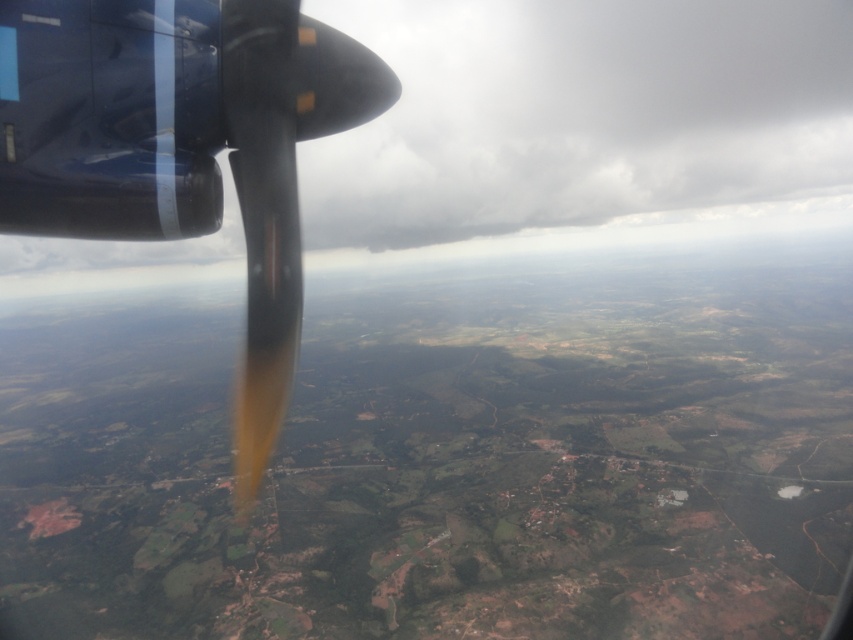
Which of these two, matte black propeller at upper left or shiny metallic propeller at upper left, stands taller?

With more height is matte black propeller at upper left.

Does matte black propeller at upper left have a larger size compared to shiny metallic propeller at upper left?

Correct, matte black propeller at upper left is larger in size than shiny metallic propeller at upper left.

Is point (326, 1) closer to viewer compared to point (151, 54)?

No.

Where is `matte black propeller at upper left`? This screenshot has width=853, height=640. matte black propeller at upper left is located at coordinates (583, 120).